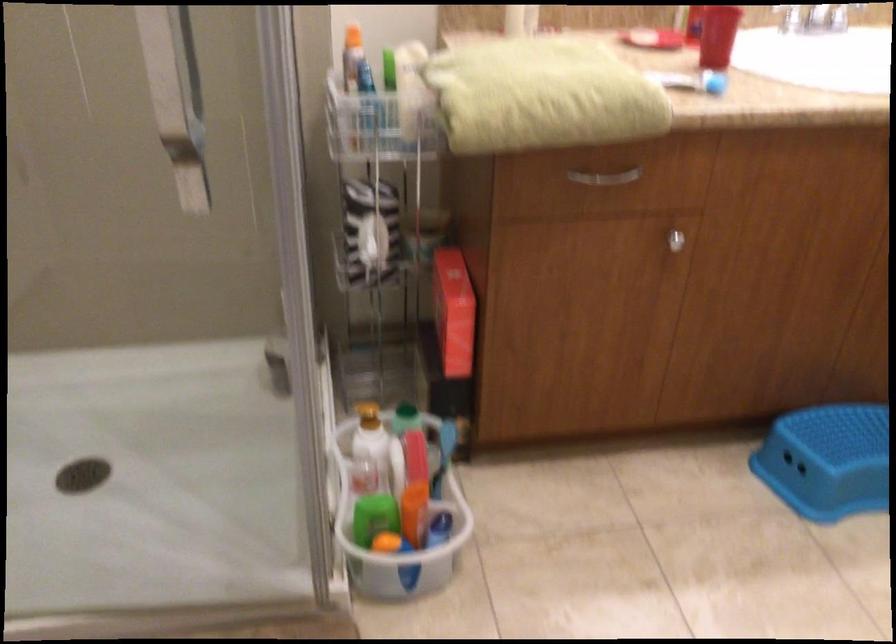
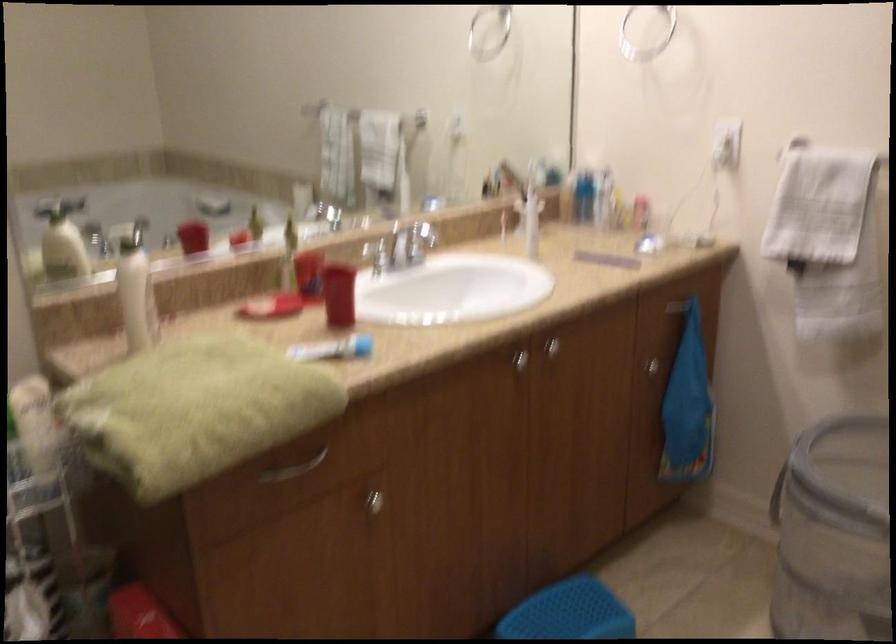
Where in the second image is the point corresponding to point (688, 78) from the first image?

(332, 348)